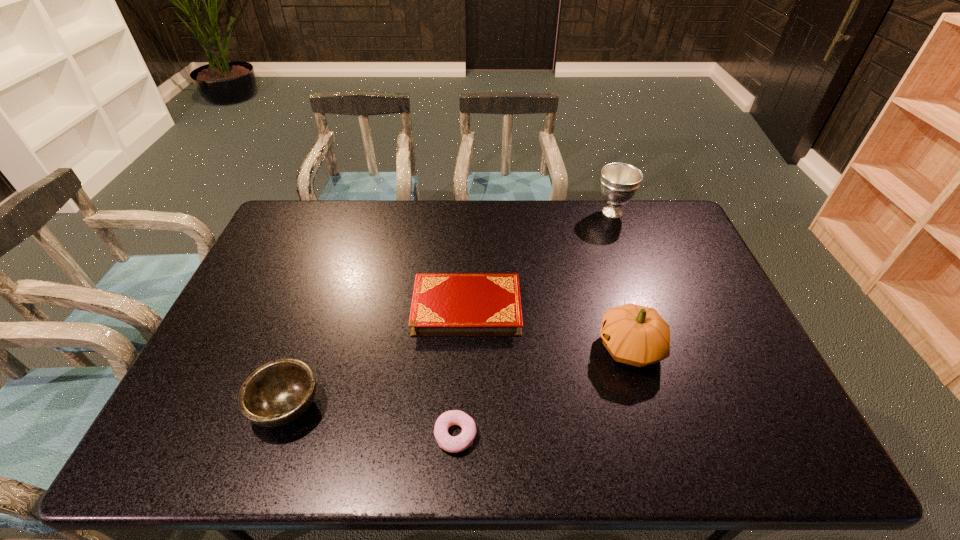
Locate an element on the screen. This screenshot has height=540, width=960. vacant area between the chalice and the doughnut is located at coordinates [x=534, y=323].

Identify the location of vacant space in between the shortest object and the gourd. (542, 391).

Where is `vacant space that's between the shortest object and the hardback book`? The width and height of the screenshot is (960, 540). vacant space that's between the shortest object and the hardback book is located at coordinates (461, 372).

Locate an element on the screen. vacant area between the hardback book and the shortest object is located at coordinates (461, 372).

Find the location of `free space between the shortest object and the chalice`. free space between the shortest object and the chalice is located at coordinates (534, 323).

In order to click on free space between the gourd and the third tallest object in this screenshot , I will do `click(459, 376)`.

Image resolution: width=960 pixels, height=540 pixels. What are the coordinates of `unoccupied area between the gourd and the leftmost object` in the screenshot? It's located at (459, 376).

Where is `empty location between the gourd and the hardback book`? empty location between the gourd and the hardback book is located at coordinates (548, 328).

At what (x,y) coordinates should I click in order to perform the action: click on object that is the fourth closest one to the bowl. Please return your answer as a coordinate pair (x, y). The width and height of the screenshot is (960, 540). Looking at the image, I should click on (619, 182).

Point out which object is positioned as the fourth nearest to the third tallest object. Please provide its 2D coordinates. Your answer should be formatted as a tuple, i.e. [(x, y)], where the tuple contains the x and y coordinates of a point satisfying the conditions above.

[(619, 182)]